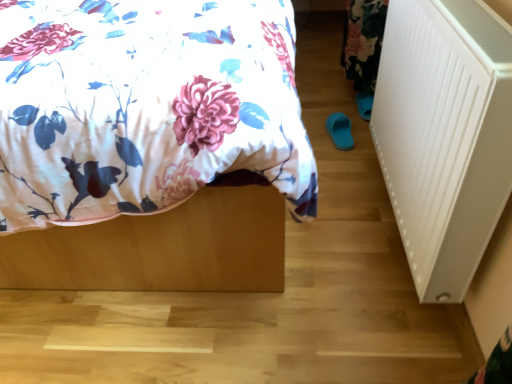
Question: Considering the relative sizes of floral fabric bed at center and white plastic radiator at right in the image provided, is floral fabric bed at center wider than white plastic radiator at right?

Choices:
 (A) no
 (B) yes

Answer: (B)

Question: Is floral fabric bed at center looking in the opposite direction of white plastic radiator at right?

Choices:
 (A) no
 (B) yes

Answer: (A)

Question: Can you confirm if floral fabric bed at center is bigger than white plastic radiator at right?

Choices:
 (A) yes
 (B) no

Answer: (A)

Question: From a real-world perspective, is floral fabric bed at center below white plastic radiator at right?

Choices:
 (A) no
 (B) yes

Answer: (A)

Question: Is floral fabric bed at center not inside white plastic radiator at right?

Choices:
 (A) yes
 (B) no

Answer: (A)

Question: Does floral fabric bed at center appear on the left side of white plastic radiator at right?

Choices:
 (A) yes
 (B) no

Answer: (A)

Question: Does white plastic radiator at right have a larger size compared to floral fabric bed at center?

Choices:
 (A) yes
 (B) no

Answer: (B)

Question: From a real-world perspective, is white plastic radiator at right positioned over floral fabric bed at center based on gravity?

Choices:
 (A) yes
 (B) no

Answer: (B)

Question: Is floral fabric bed at center inside white plastic radiator at right?

Choices:
 (A) no
 (B) yes

Answer: (A)

Question: Considering the relative sizes of white plastic radiator at right and floral fabric bed at center in the image provided, is white plastic radiator at right taller than floral fabric bed at center?

Choices:
 (A) no
 (B) yes

Answer: (A)

Question: Does white plastic radiator at right have a lesser height compared to floral fabric bed at center?

Choices:
 (A) no
 (B) yes

Answer: (B)

Question: Does white plastic radiator at right appear on the left side of floral fabric bed at center?

Choices:
 (A) no
 (B) yes

Answer: (A)

Question: Is point (446, 173) closer or farther from the camera than point (111, 236)?

Choices:
 (A) farther
 (B) closer

Answer: (B)